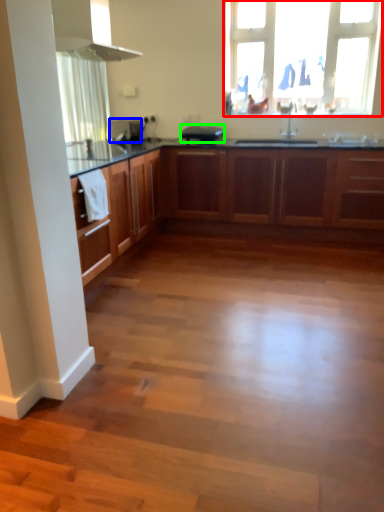
Question: Which is nearer to the window (highlighted by a red box)? appliance (highlighted by a blue box) or appliance (highlighted by a green box).

Choices:
 (A) appliance
 (B) appliance

Answer: (B)